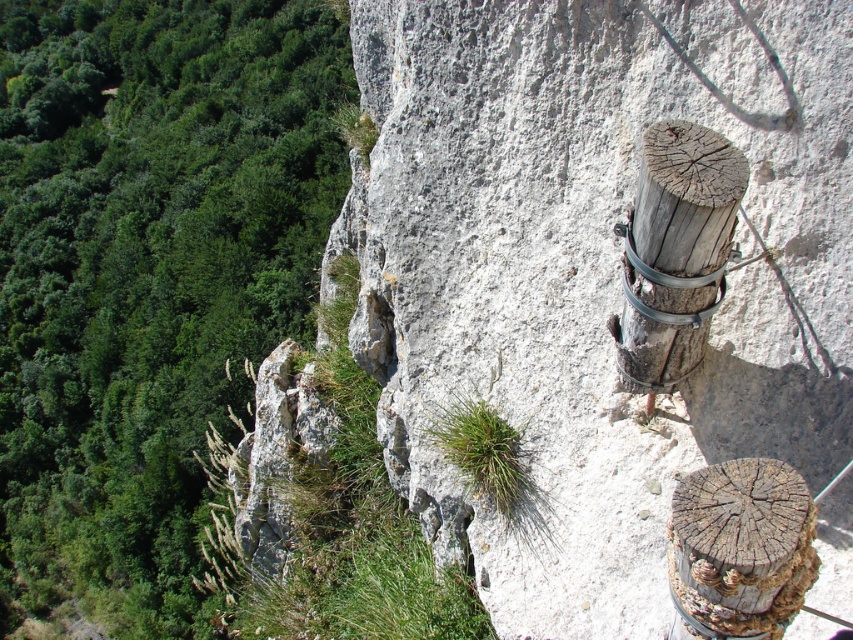
Question: Does smooth gray rock at center appear on the left side of green leafy vegetation at left?

Choices:
 (A) yes
 (B) no

Answer: (B)

Question: Can you confirm if green leafy vegetation at left is positioned to the right of weathered wood post at right?

Choices:
 (A) yes
 (B) no

Answer: (B)

Question: Which is nearer to the weathered wood post at right?

Choices:
 (A) smooth gray rock at center
 (B) green leafy vegetation at left

Answer: (A)

Question: Which point is closer to the camera taking this photo?

Choices:
 (A) (643, 138)
 (B) (659, 612)

Answer: (A)

Question: Can you confirm if smooth gray rock at center is positioned to the left of green leafy vegetation at left?

Choices:
 (A) no
 (B) yes

Answer: (A)

Question: Among these points, which one is farthest from the camera?

Choices:
 (A) (715, 301)
 (B) (20, 56)
 (C) (364, 257)

Answer: (B)